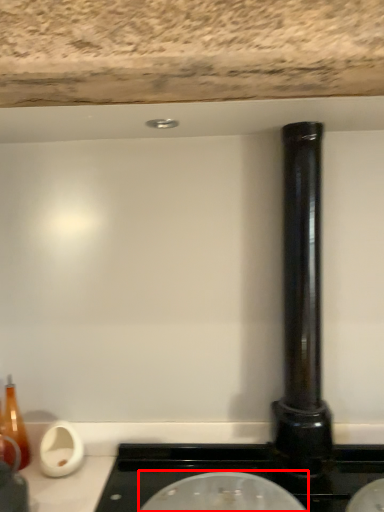
Question: In this image, where is appliance (annotated by the red box) located relative to pillar?

Choices:
 (A) right
 (B) left

Answer: (B)